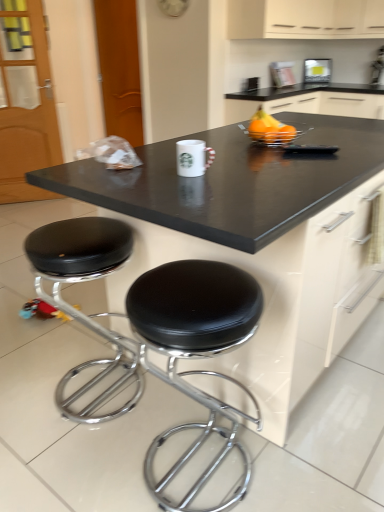
Question: Would you say black laminate countertop at center is part of matte plastic light at upper center's contents?

Choices:
 (A) yes
 (B) no

Answer: (B)

Question: Can you confirm if matte plastic light at upper center is bigger than black laminate countertop at center?

Choices:
 (A) yes
 (B) no

Answer: (B)

Question: Considering the relative positions of matte plastic light at upper center and black laminate countertop at center in the image provided, is matte plastic light at upper center in front of black laminate countertop at center?

Choices:
 (A) yes
 (B) no

Answer: (B)

Question: Is matte plastic light at upper center smaller than black laminate countertop at center?

Choices:
 (A) no
 (B) yes

Answer: (B)

Question: Is matte plastic light at upper center not within black laminate countertop at center?

Choices:
 (A) yes
 (B) no

Answer: (A)

Question: Is matte plastic light at upper center facing away from black laminate countertop at center?

Choices:
 (A) yes
 (B) no

Answer: (B)

Question: From the image's perspective, is black leather stool at lower left, which is the 2th stool in right-to-left order, located beneath black leather stool at lower center, which ranks as the 1th stool in right-to-left order?

Choices:
 (A) no
 (B) yes

Answer: (A)

Question: From a real-world perspective, is black leather stool at lower left, positioned as the first stool in left-to-right order, under black leather stool at lower center, which is the 2th stool in left-to-right order?

Choices:
 (A) yes
 (B) no

Answer: (A)

Question: Can you confirm if black leather stool at lower left, positioned as the first stool in left-to-right order, is positioned to the right of black leather stool at lower center, which ranks as the 1th stool in right-to-left order?

Choices:
 (A) no
 (B) yes

Answer: (A)

Question: From the image's perspective, is black leather stool at lower left, positioned as the first stool in left-to-right order, over black leather stool at lower center, which ranks as the 1th stool in right-to-left order?

Choices:
 (A) no
 (B) yes

Answer: (B)

Question: Is black leather stool at lower left, which is the 2th stool in right-to-left order, with black leather stool at lower center, which ranks as the 1th stool in right-to-left order?

Choices:
 (A) no
 (B) yes

Answer: (A)

Question: Can you confirm if black leather stool at lower left, which is the 2th stool in right-to-left order, is thinner than black leather stool at lower center, which is the 2th stool in left-to-right order?

Choices:
 (A) no
 (B) yes

Answer: (B)

Question: From a real-world perspective, is black leather stool at lower left, which is the 2th stool in right-to-left order, under matte plastic light at upper center?

Choices:
 (A) no
 (B) yes

Answer: (B)